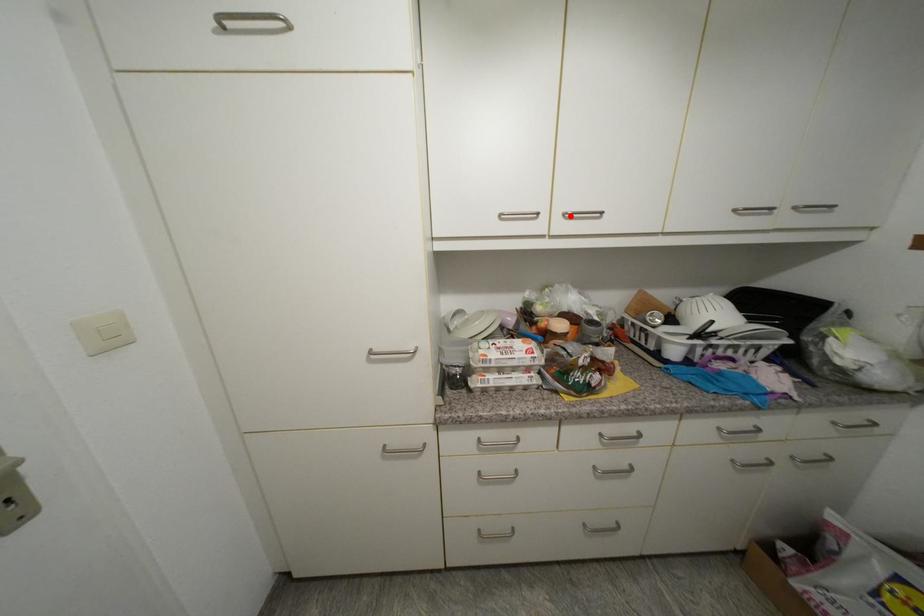
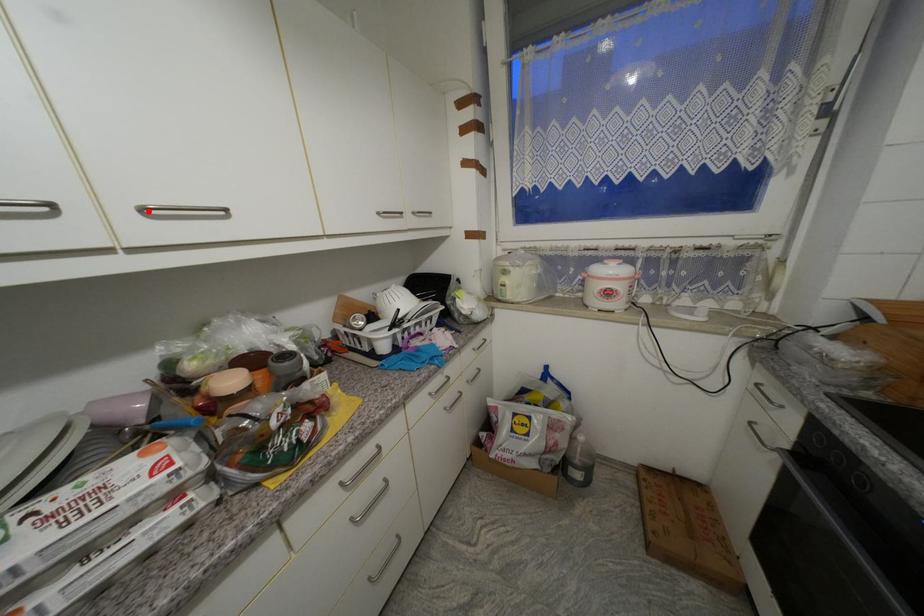
I am providing you with two images of the same scene from different viewpoints. A red point is marked on the first image and another point is marked on the second image. Is the red point in image1 aligned with the point shown in image2?

Yes